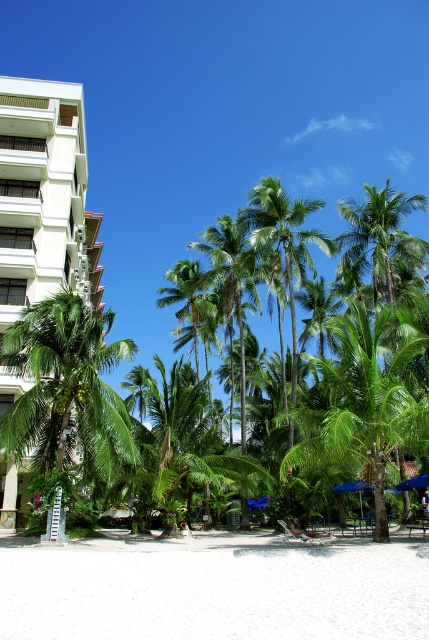
Consider the image. You are standing on the white sand beach at lower center and want to reach the white plastic beach chair at center. Which direction should you walk to get there?

You should walk to the right because the white plastic beach chair at center is to the right of the white sand beach at lower center.

You are a visitor at the beach and want to find shade. You see the green leafy palm tree at left and the blue fabric umbrella at center. Which one provides taller shade?

The green leafy palm tree at left is taller than the blue fabric umbrella at center, so it provides taller shade.

You are standing at the center of the beach and want to find the green leafy palm tree at left. According to the coordinates provided, in which direction should you look to see it?

The green leafy palm tree at left is located at point (66, 387), which means it is positioned to the left side of the scene. Therefore, you should look to your left to see it.